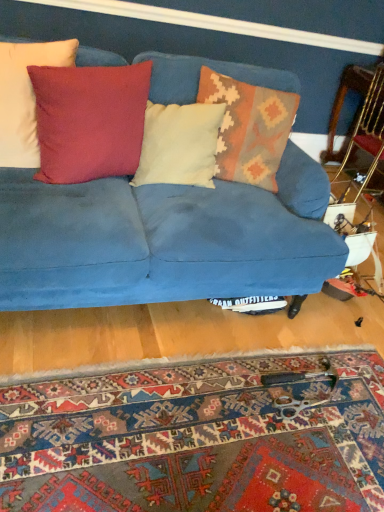
Question: Considering the positions of point (299, 159) and point (52, 83), is point (299, 159) closer or farther from the camera than point (52, 83)?

Choices:
 (A) farther
 (B) closer

Answer: (A)

Question: Do you think velvet blue couch at center is within suede-like red pillow at upper left, the second pillow in the left-to-right sequence, or outside of it?

Choices:
 (A) inside
 (B) outside

Answer: (B)

Question: Considering the real-world distances, which object is farthest from the wooden armchair at right?

Choices:
 (A) suede-like red pillow at upper left, placed as the third pillow when sorted from right to left
 (B) matte red pillow at upper left, positioned as the fourth pillow in right-to-left order
 (C) knitted wool pillow at center, which ranks as the fourth pillow in left-to-right order
 (D) velvet blue couch at center
 (E) light blue suede pillow at center, which is the 3th pillow in left-to-right order

Answer: (B)

Question: Which of these objects is positioned farthest from the velvet blue couch at center?

Choices:
 (A) carpet with intricate patterns at lower center
 (B) matte red pillow at upper left, which is counted as the first pillow, starting from the left
 (C) knitted wool pillow at center, which ranks as the fourth pillow in left-to-right order
 (D) suede-like red pillow at upper left, placed as the third pillow when sorted from right to left
 (E) wooden armchair at right

Answer: (E)